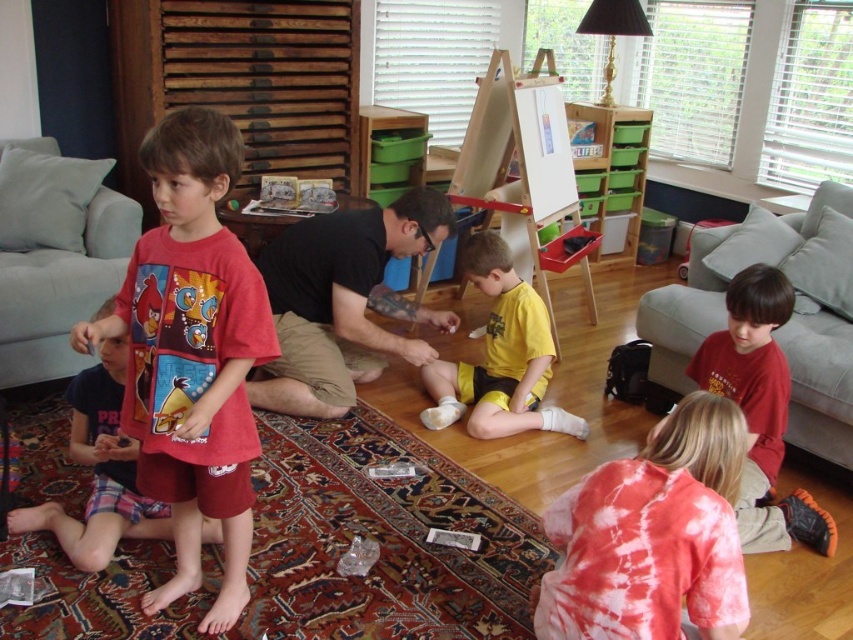
Who is more distant from viewer, (201, 412) or (209, 532)?

Point (209, 532)

Is point (173, 435) in front of point (97, 538)?

Yes, it is.

Does point (225, 333) come closer to viewer compared to point (86, 376)?

Yes, it is in front of point (86, 376).

Locate an element on the screen. The image size is (853, 640). matte red t-shirt at center is located at coordinates click(192, 355).

Image resolution: width=853 pixels, height=640 pixels. Describe the element at coordinates (192, 355) in the screenshot. I see `matte red t-shirt at center` at that location.

What do you see at coordinates (192, 355) in the screenshot? I see `matte red t-shirt at center` at bounding box center [192, 355].

Find the location of `matte red t-shirt at center`. matte red t-shirt at center is located at coordinates (192, 355).

Can you confirm if matte red t-shirt at center is positioned to the left of yellow matte shorts at center?

Yes, matte red t-shirt at center is to the left of yellow matte shorts at center.

Is point (160, 355) in front of point (469, 396)?

Yes, point (160, 355) is closer to viewer.

Locate an element on the screen. matte red t-shirt at center is located at coordinates (192, 355).